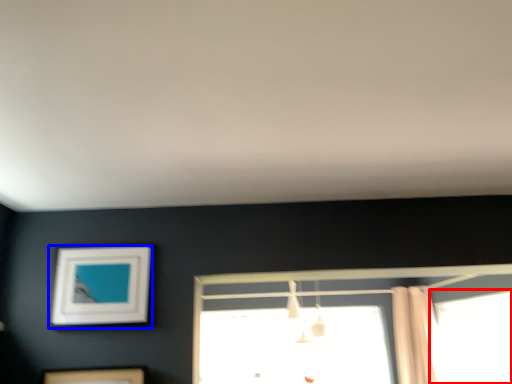
Question: Which point is further to the camera, window (highlighted by a red box) or picture frame (highlighted by a blue box)?

Choices:
 (A) window
 (B) picture frame

Answer: (A)